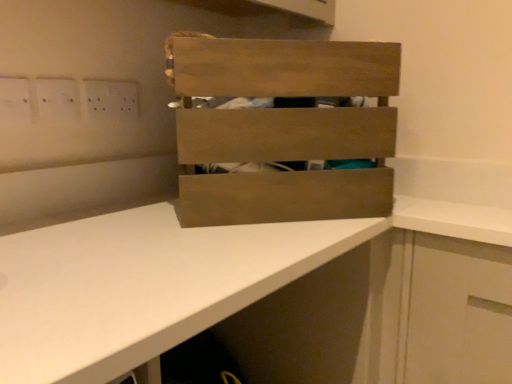
The image size is (512, 384). Identify the location of free space in front of wooden crate at center. (216, 247).